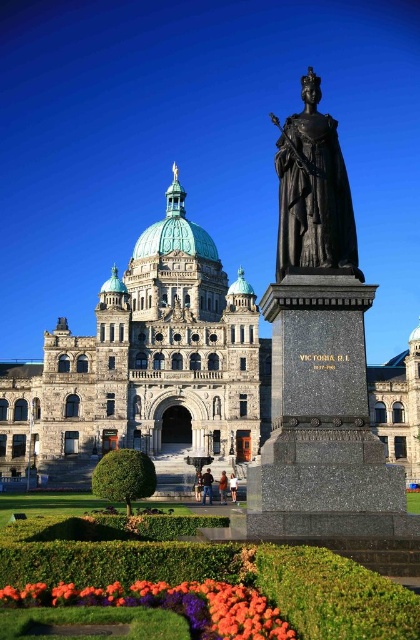
How much distance is there between stone building at center and orange matte flowers at lower left?

stone building at center and orange matte flowers at lower left are 49.78 meters apart.

The height and width of the screenshot is (640, 420). Describe the element at coordinates (144, 369) in the screenshot. I see `stone building at center` at that location.

Identify the location of stone building at center. The width and height of the screenshot is (420, 640). (144, 369).

Who is higher up, green grass at lower center or orange matte flowers at lower left?

orange matte flowers at lower left is higher up.

Does green grass at lower center have a lesser height compared to orange matte flowers at lower left?

Incorrect, green grass at lower center's height does not fall short of orange matte flowers at lower left's.

Does point (378, 632) come farther from viewer compared to point (241, 593)?

No, it is not.

Locate an element on the screen. The width and height of the screenshot is (420, 640). green grass at lower center is located at coordinates (212, 572).

Describe the element at coordinates (144, 369) in the screenshot. I see `stone building at center` at that location.

Which is more to the left, stone building at center or bronze statue at center?

Positioned to the left is stone building at center.

This screenshot has height=640, width=420. What do you see at coordinates (144, 369) in the screenshot?
I see `stone building at center` at bounding box center [144, 369].

Locate an element on the screen. The height and width of the screenshot is (640, 420). stone building at center is located at coordinates (144, 369).